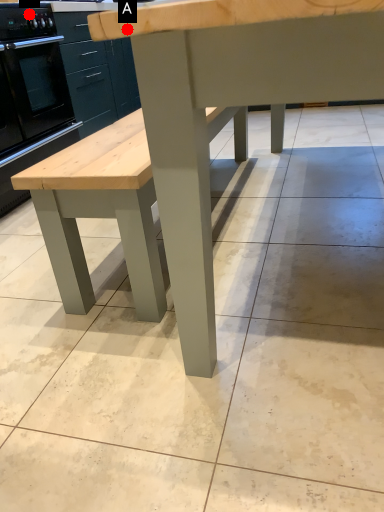
Question: Two points are circled on the image, labeled by A and B beside each circle. Which point is farther from the camera taking this photo?

Choices:
 (A) A is further
 (B) B is further

Answer: (B)